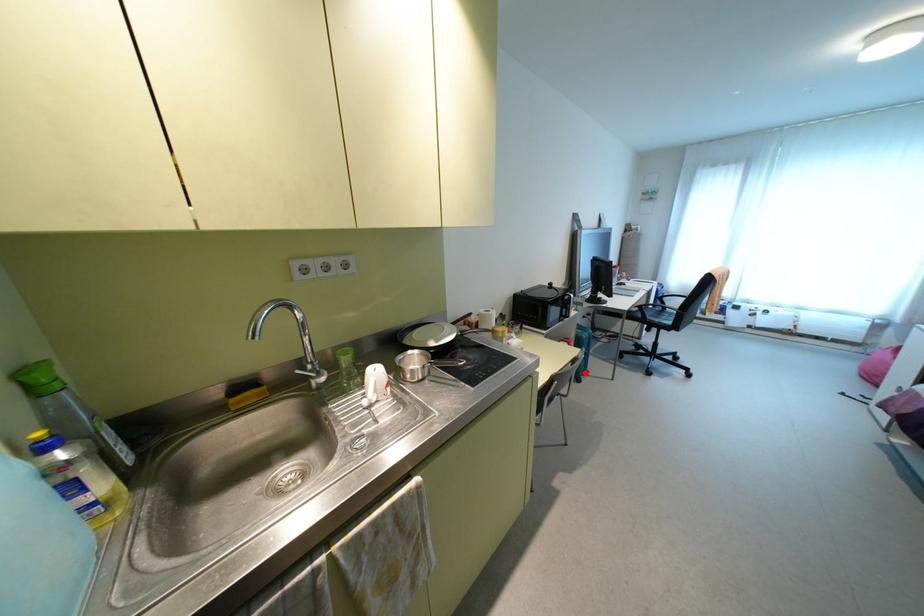
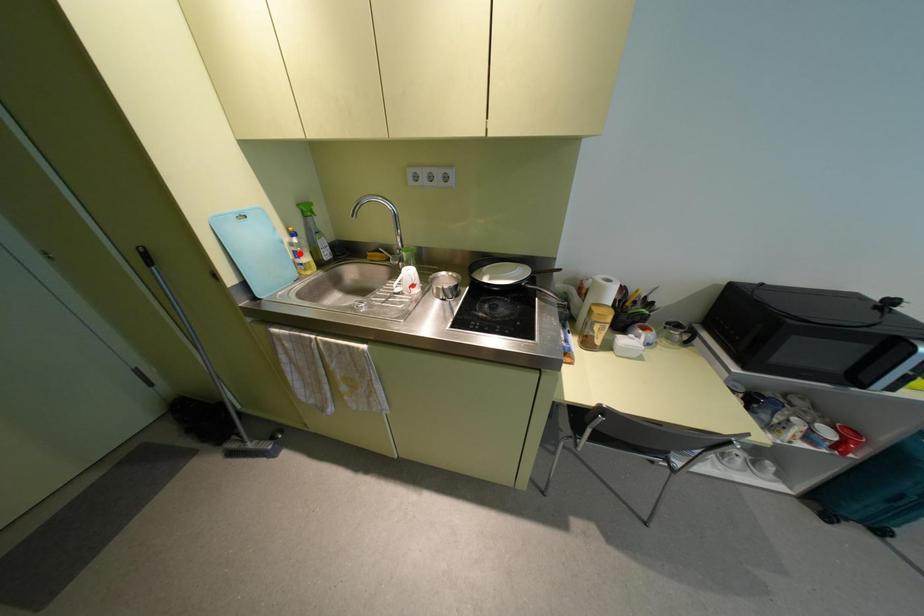
I am providing you with two images of the same scene from different viewpoints. A red point is marked on the first image and another point is marked on the second image. Is the red point in image1 aligned with the point shown in image2?

No